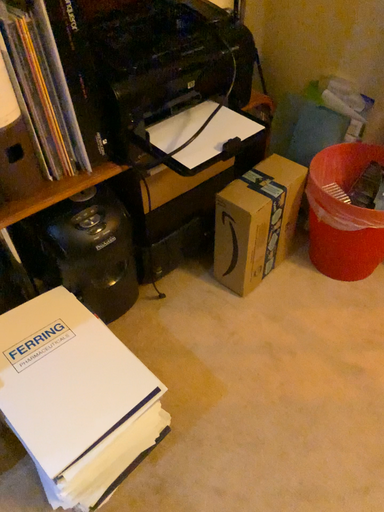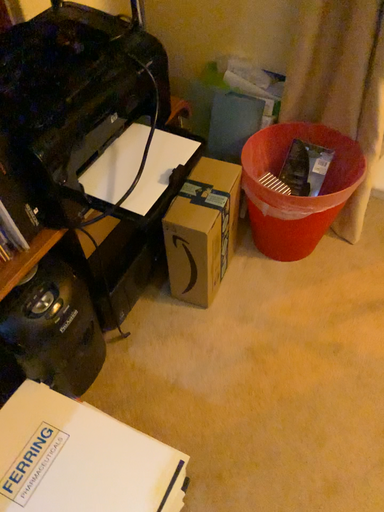
Question: How did the camera likely rotate when shooting the video?

Choices:
 (A) rotated right
 (B) rotated left

Answer: (A)